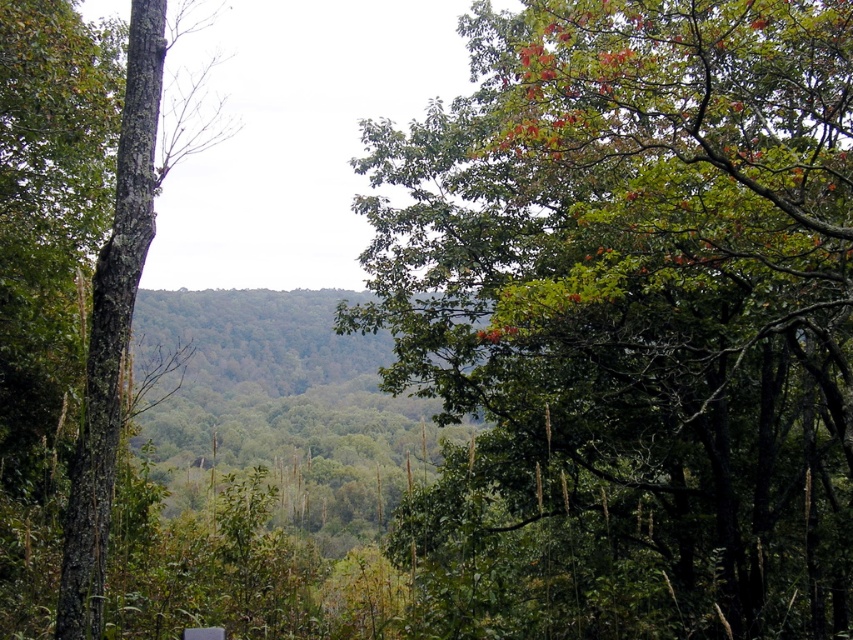
You are a hiker carrying a 2.5 meter long ladder. You need to place it between the green leafy tree at upper center and the green rough bark tree at left. Will the ladder fit in the space between them?

The distance between the green leafy tree at upper center and the green rough bark tree at left is 6.61 meters, so the ladder that is 2.5 meters long will fit comfortably between them.

You are standing in the forest and want to find your way out. You see a green leafy tree at upper center and a green rough bark tree at left. Which tree should you head towards if you want to move towards the right direction?

The green leafy tree at upper center is to the right of the green rough bark tree at left. So, if you want to move towards the right direction, you should head towards the green leafy tree at upper center.

You are standing in the forest and want to take a photo of the green leafy tree at upper center. If your camera has a maximum focus range of 5 meters, will you need to move closer to capture it clearly?

The green leafy tree at upper center is 5.68 meters away from the viewer. Since the camera can only focus up to 5 meters, you need to move closer to ensure the tree is within the focus range.